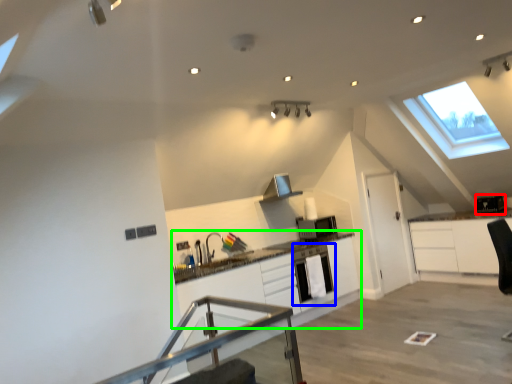
Question: Considering the real-world distances, which object is farthest from appliance (highlighted by a red box)? dish washer (highlighted by a blue box) or cabinetry (highlighted by a green box)?

Choices:
 (A) dish washer
 (B) cabinetry

Answer: (B)